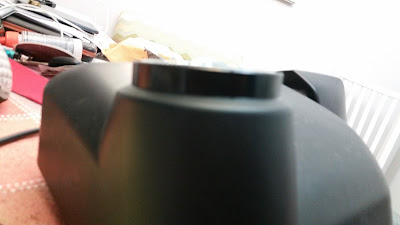
This screenshot has width=400, height=225. I want to click on clutter objects on each other, so click(x=75, y=31), click(x=55, y=19), click(x=14, y=19).